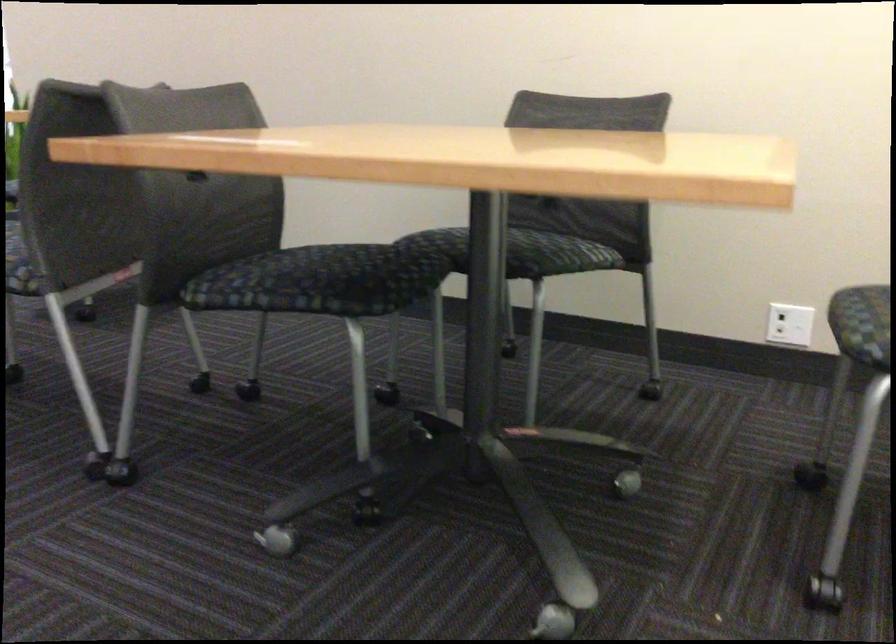
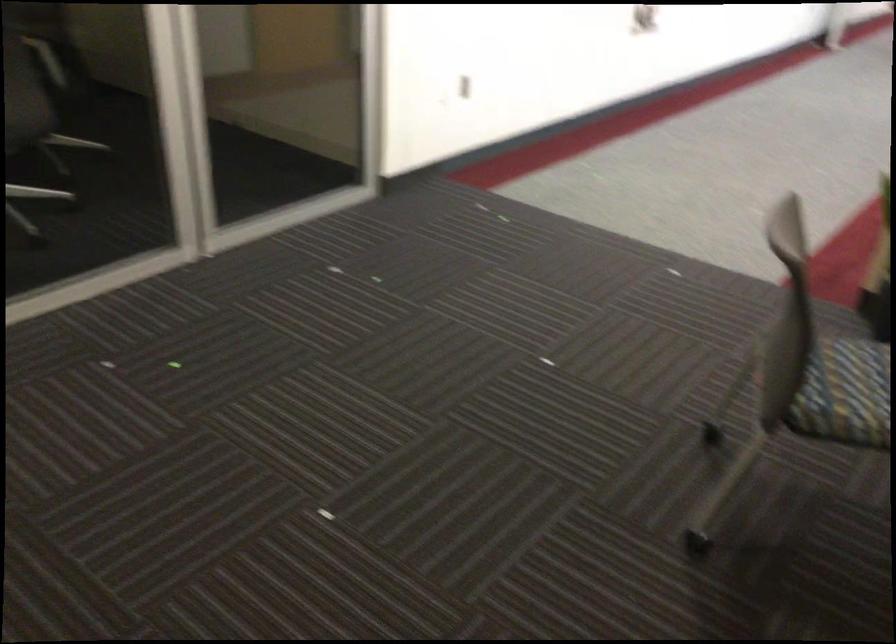
Question: In a continuous first-person perspective shot, in which direction is the camera moving?

Choices:
 (A) Left
 (B) Right
 (C) Forward
 (D) Backward

Answer: (A)